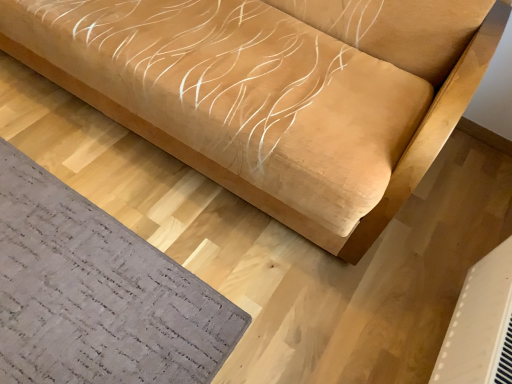
Locate an element on the screen. This screenshot has height=384, width=512. free space to the back side of gray textured mat at lower left is located at coordinates (106, 156).